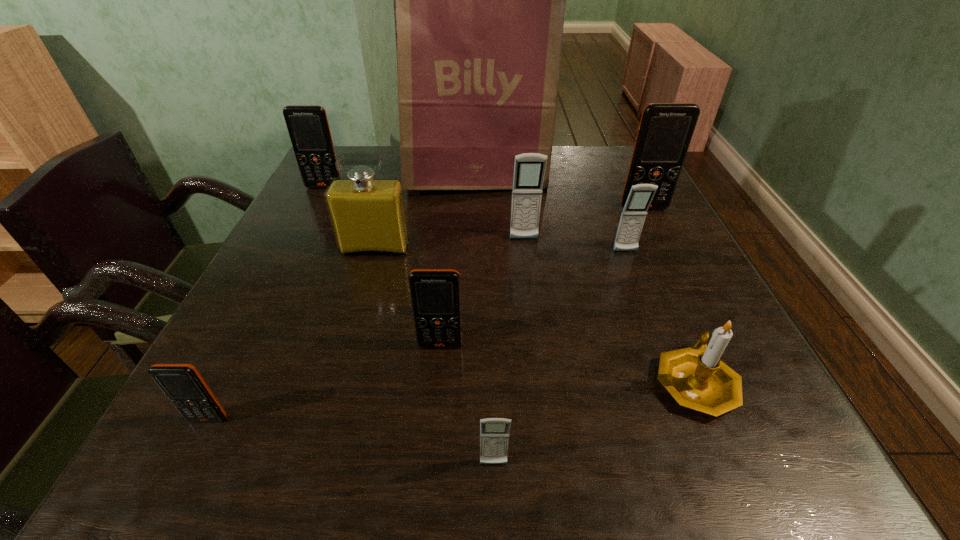
Where is `vacant point located 0.140m on the front-facing side of the fifth cellular telephone from left to right`? The height and width of the screenshot is (540, 960). vacant point located 0.140m on the front-facing side of the fifth cellular telephone from left to right is located at coordinates (530, 284).

Where is `free space located 0.330m on the screen of the farthest cellular telephone`? free space located 0.330m on the screen of the farthest cellular telephone is located at coordinates (283, 269).

Image resolution: width=960 pixels, height=540 pixels. I want to click on free location located 0.240m on the front-facing side of the second cellular telephone from right to left, so click(659, 336).

Where is `vacant space situated on the screen of the second smallest orange cellular telephone`? This screenshot has width=960, height=540. vacant space situated on the screen of the second smallest orange cellular telephone is located at coordinates (436, 399).

Identify the location of free space located on the back of the candle holder. Image resolution: width=960 pixels, height=540 pixels. (662, 306).

You are a GUI agent. You are given a task and a screenshot of the screen. Output one action in this format:
    pyautogui.click(x=<x>, y=<y>)
    Task: Click on the free space located 0.080m on the screen of the second nearest cellular telephone
    The image size is (960, 540).
    Given the screenshot: What is the action you would take?
    pyautogui.click(x=180, y=475)

Locate an element on the screen. This screenshot has width=960, height=540. grocery bag positioned at the far edge is located at coordinates (479, 0).

Locate an element on the screen. The width and height of the screenshot is (960, 540). cellular telephone positioned at the far edge is located at coordinates (308, 127).

Identify the location of candle holder that is positioned at the near edge. pos(697,379).

The width and height of the screenshot is (960, 540). I want to click on perfume at the left edge, so click(x=368, y=215).